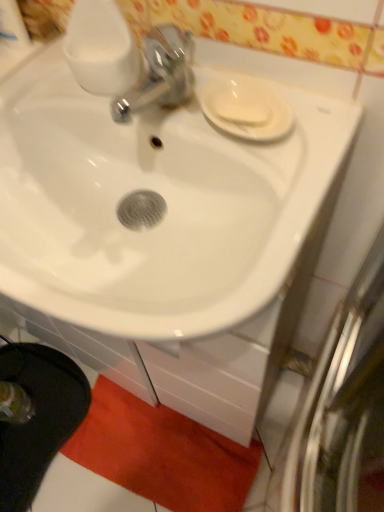
You are a GUI agent. You are given a task and a screenshot of the screen. Output one action in this format:
    pyautogui.click(x=<x>, y=<y>)
    Task: Click on the free spot to the left of white glossy saucer at upper right
    The height and width of the screenshot is (512, 384).
    Given the screenshot: What is the action you would take?
    pyautogui.click(x=152, y=120)